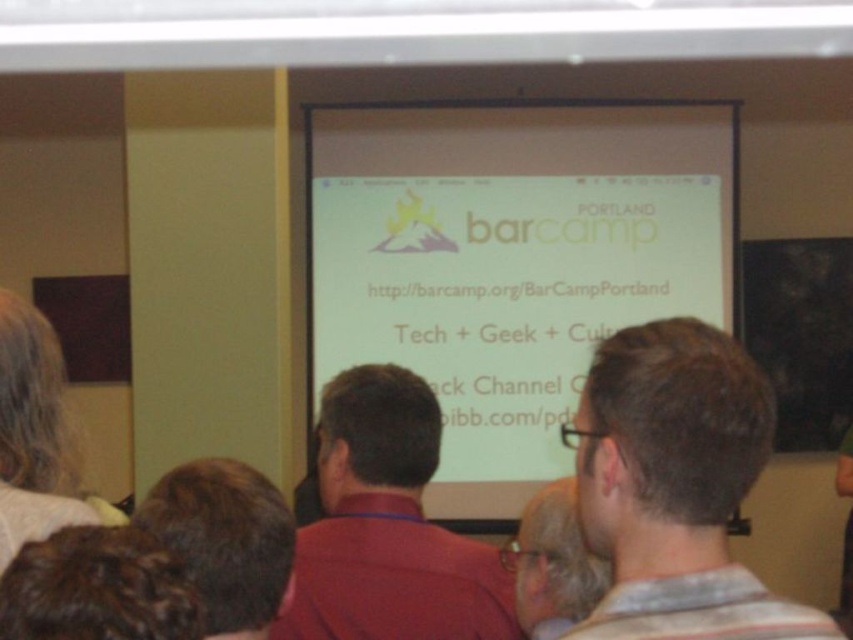
Question: Does brown hair at upper right appear over matte black shirt at center?

Choices:
 (A) no
 (B) yes

Answer: (B)

Question: Estimate the real-world distances between objects in this image. Which object is farther from the matte black shirt at center?

Choices:
 (A) brown hair at lower left
 (B) brown hair at upper right
 (C) white matte projection screen at center
 (D) red matte shirt at center

Answer: (C)

Question: Which object is the farthest from the brown hair at upper right?

Choices:
 (A) white matte projection screen at center
 (B) matte black shirt at center
 (C) brown hair at lower left

Answer: (A)

Question: Observing the image, what is the correct spatial positioning of white matte projection screen at center in reference to red matte shirt at center?

Choices:
 (A) right
 (B) left

Answer: (A)

Question: Which of these objects is positioned closest to the red matte shirt at center?

Choices:
 (A) brown hair at lower left
 (B) brown hair at upper right
 (C) white matte projection screen at center
 (D) matte black shirt at center

Answer: (D)

Question: Is red matte shirt at center behind brown hair at lower left?

Choices:
 (A) no
 (B) yes

Answer: (B)